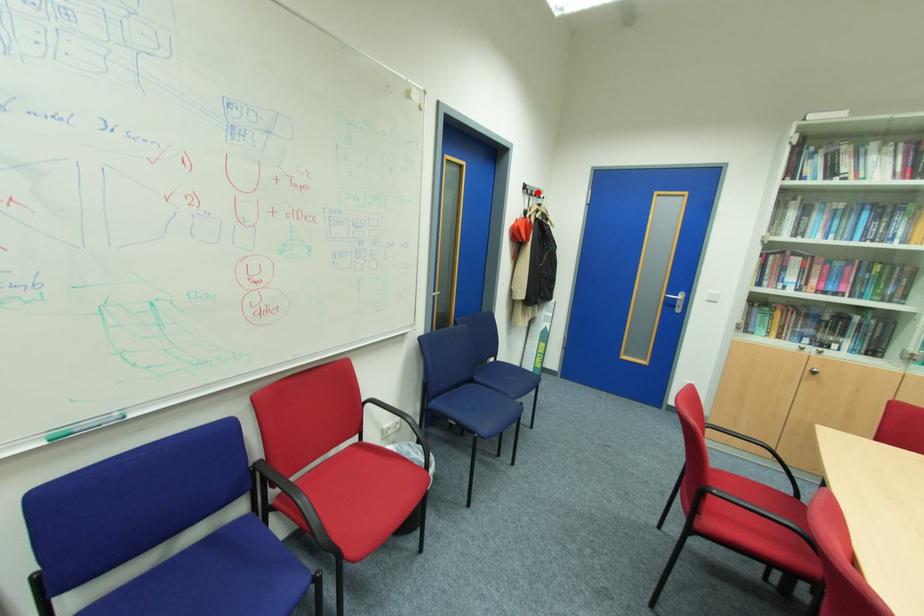
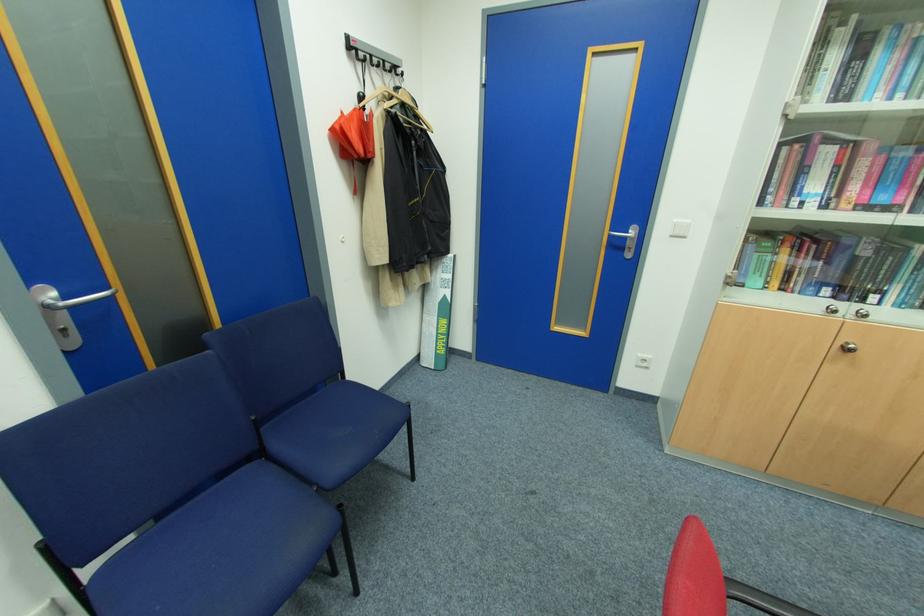
The point at the highlighted location is marked in the first image. Where is the corresponding point in the second image?

(380, 60)